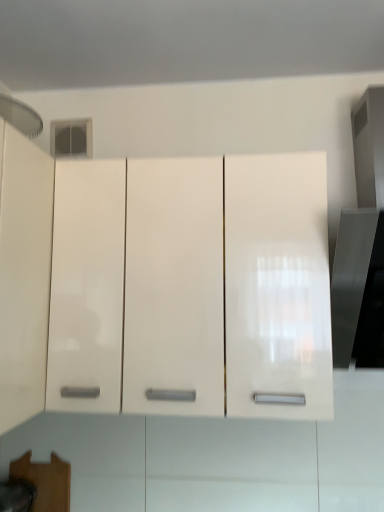
Question: Is glossy white cabinet at center inside or outside of brushed metal exhaust hood at upper left?

Choices:
 (A) outside
 (B) inside

Answer: (A)

Question: In terms of width, does glossy white cabinet at center look wider or thinner when compared to brushed metal exhaust hood at upper left?

Choices:
 (A) thin
 (B) wide

Answer: (B)

Question: Is glossy white cabinet at center taller or shorter than brushed metal exhaust hood at upper left?

Choices:
 (A) short
 (B) tall

Answer: (B)

Question: Considering their positions, is brushed metal exhaust hood at upper left located in front of or behind glossy white cabinet at center?

Choices:
 (A) behind
 (B) front

Answer: (B)

Question: From their relative heights in the image, would you say brushed metal exhaust hood at upper left is taller or shorter than glossy white cabinet at center?

Choices:
 (A) short
 (B) tall

Answer: (A)

Question: From a real-world perspective, relative to glossy white cabinet at center, is brushed metal exhaust hood at upper left vertically above or below?

Choices:
 (A) above
 (B) below

Answer: (A)

Question: Considering the positions of brushed metal exhaust hood at upper left and glossy white cabinet at center in the image, is brushed metal exhaust hood at upper left wider or thinner than glossy white cabinet at center?

Choices:
 (A) thin
 (B) wide

Answer: (A)